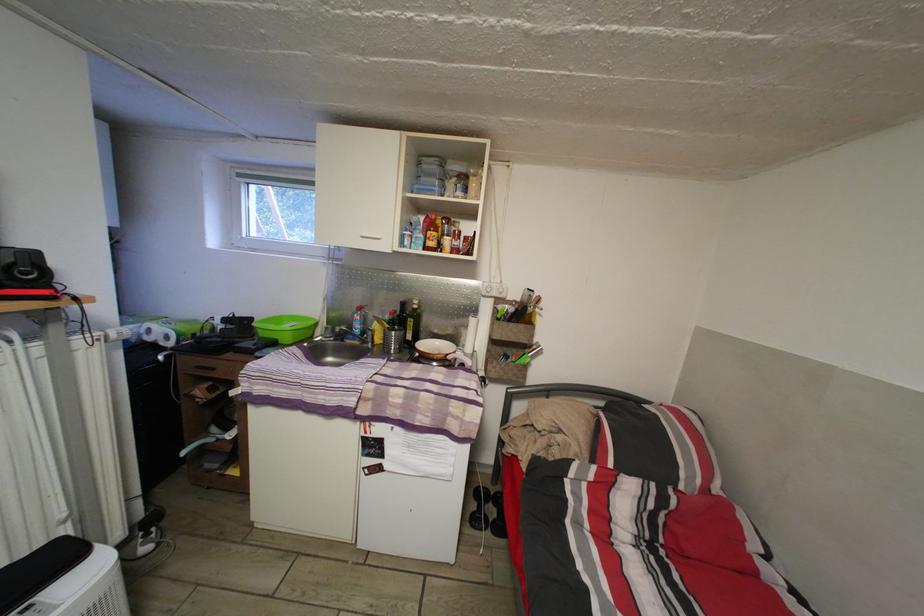
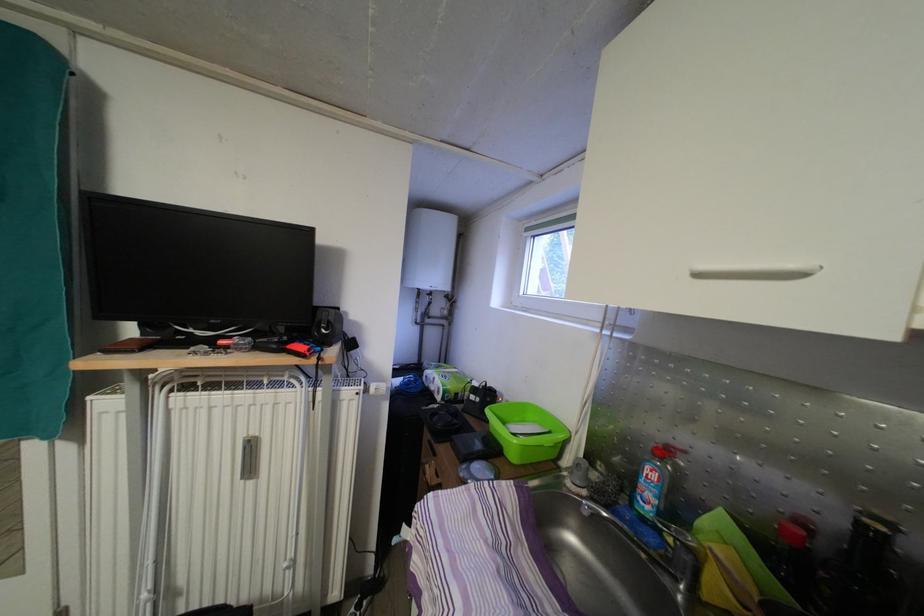
Locate, in the second image, the point that corresponds to the point at 365,323 in the first image.

(661, 484)